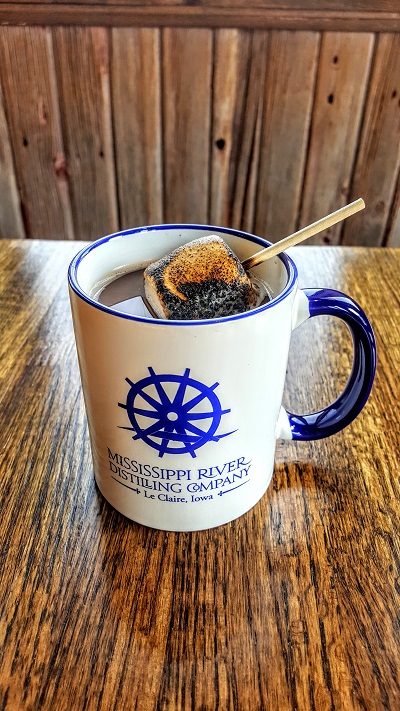
Locate an element on the screen. handle is located at coordinates (360, 326).